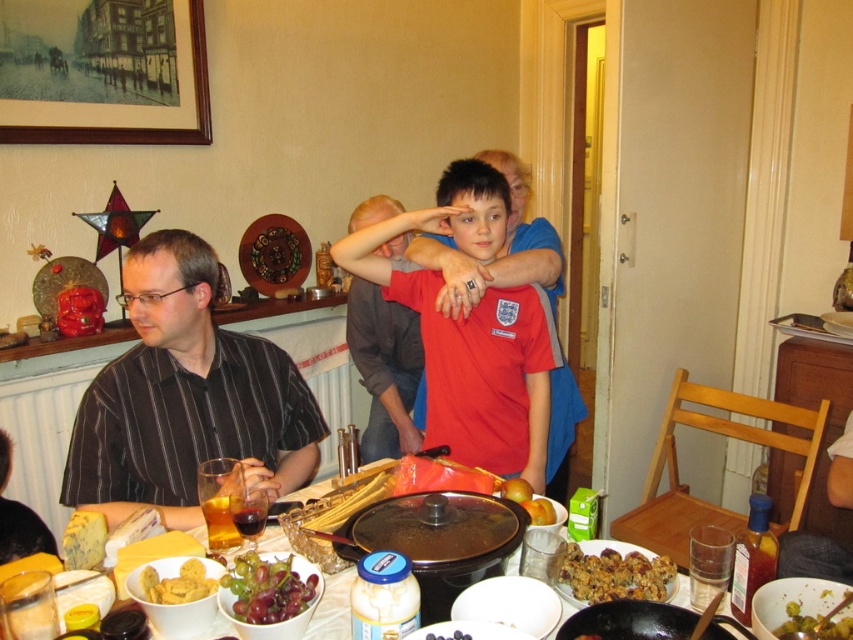
Is wooden picture frame at upper left positioned at the back of yellow matte cookies at lower left?

Yes.

What are the coordinates of `wooden picture frame at upper left` in the screenshot? It's located at (103, 72).

The width and height of the screenshot is (853, 640). Describe the element at coordinates (332, 609) in the screenshot. I see `matte plastic bowl at center` at that location.

Can you confirm if matte plastic bowl at center is taller than green glossy olives at center?

Indeed, matte plastic bowl at center has a greater height compared to green glossy olives at center.

At what (x,y) coordinates should I click in order to perform the action: click on matte plastic bowl at center. Please return your answer as a coordinate pair (x, y). Looking at the image, I should click on (332, 609).

Is green matte grapes at lower center to the right of yellow matte cookies at lower left from the viewer's perspective?

Indeed, green matte grapes at lower center is positioned on the right side of yellow matte cookies at lower left.

Which is behind, point (276, 621) or point (177, 582)?

Positioned behind is point (177, 582).

Does point (296, 600) come behind point (180, 595)?

That is False.

Where is `green matte grapes at lower center`? The height and width of the screenshot is (640, 853). green matte grapes at lower center is located at coordinates (268, 589).